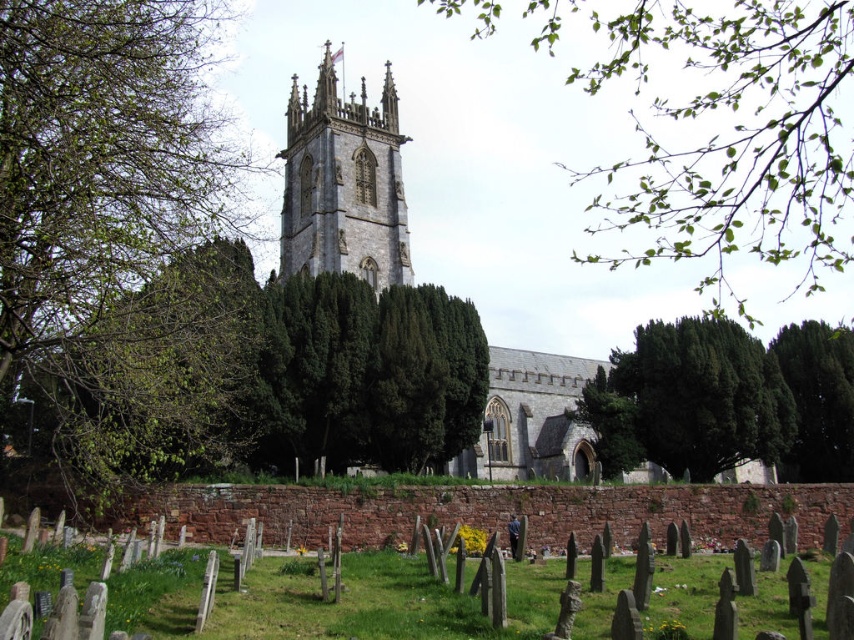
Question: Can you confirm if stone church at center is positioned to the right of green textured tree at center?

Choices:
 (A) no
 (B) yes

Answer: (A)

Question: Estimate the real-world distances between objects in this image. Which object is farther from the stone gothic tower at center?

Choices:
 (A) green leafy branch at upper center
 (B) green leafy tree at left
 (C) stone church at center

Answer: (A)

Question: Which is nearer to the stone church at center?

Choices:
 (A) stone gothic tower at center
 (B) green coniferous tree at center
 (C) green textured tree at center

Answer: (A)

Question: Can you confirm if green leafy branch at upper center is smaller than green leafy tree at left?

Choices:
 (A) yes
 (B) no

Answer: (B)

Question: Is stone church at center further to camera compared to stone gothic tower at center?

Choices:
 (A) yes
 (B) no

Answer: (B)

Question: Which object is positioned farthest from the stone church at center?

Choices:
 (A) stone gothic tower at center
 (B) green leafy branch at upper center

Answer: (B)